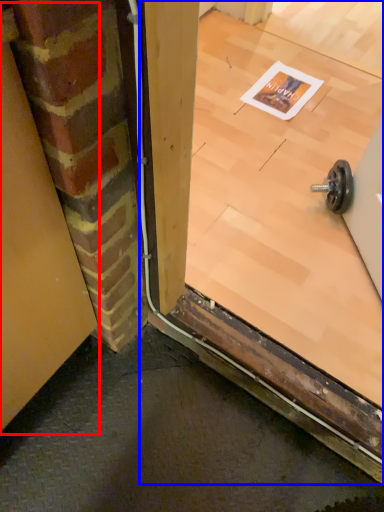
Question: Which point is further to the camera, garage door (highlighted by a red box) or window (highlighted by a blue box)?

Choices:
 (A) garage door
 (B) window

Answer: (B)